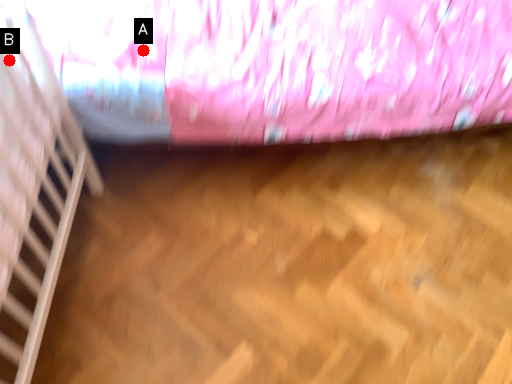
Question: Two points are circled on the image, labeled by A and B beside each circle. Which point appears closest to the camera in this image?

Choices:
 (A) A is closer
 (B) B is closer

Answer: (B)